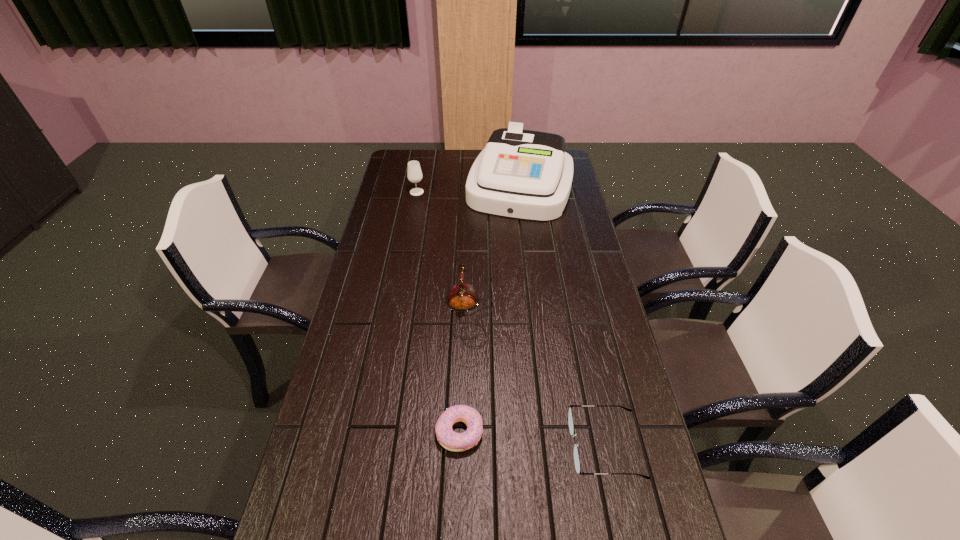
The image size is (960, 540). I want to click on free spot at the right edge of the desktop, so click(x=653, y=526).

What are the coordinates of `empty space between the third nearest object and the glass` in the screenshot? It's located at (443, 253).

Where is `free space between the leftmost object and the telephone`? The image size is (960, 540). free space between the leftmost object and the telephone is located at coordinates (443, 253).

Where is `free point between the third shortest object and the shortest object`? This screenshot has width=960, height=540. free point between the third shortest object and the shortest object is located at coordinates (464, 373).

Locate an element on the screen. free space between the doughnut and the spectacles is located at coordinates (532, 438).

Identify the location of empty location between the spectacles and the third shortest object. (537, 380).

Identify the location of vacant space in between the doughnut and the spectacles. This screenshot has height=540, width=960. (532, 438).

The width and height of the screenshot is (960, 540). I want to click on empty space that is in between the cash register and the doughnut, so click(x=490, y=309).

I want to click on unoccupied area between the fourth tallest object and the cash register, so click(563, 316).

Identify the location of empty space between the spectacles and the cash register. (563, 316).